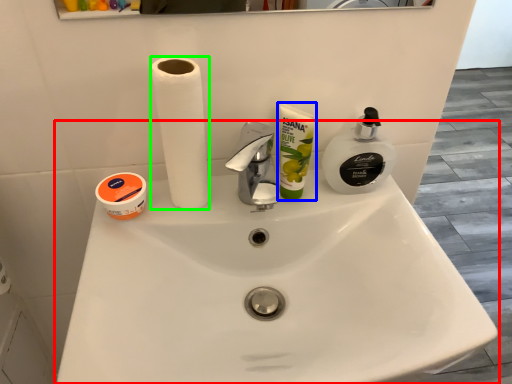
Question: Considering the real-world distances, which object is closest to sink (highlighted by a red box)? product (highlighted by a blue box) or paper towel (highlighted by a green box).

Choices:
 (A) product
 (B) paper towel

Answer: (A)